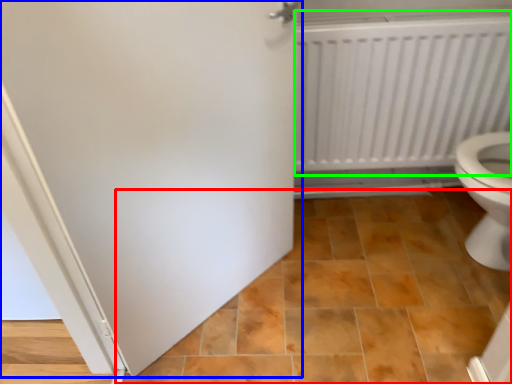
Question: Which is nearer to the ceramic tile (highlighted by a red box)? door (highlighted by a blue box) or radiator (highlighted by a green box).

Choices:
 (A) door
 (B) radiator

Answer: (A)